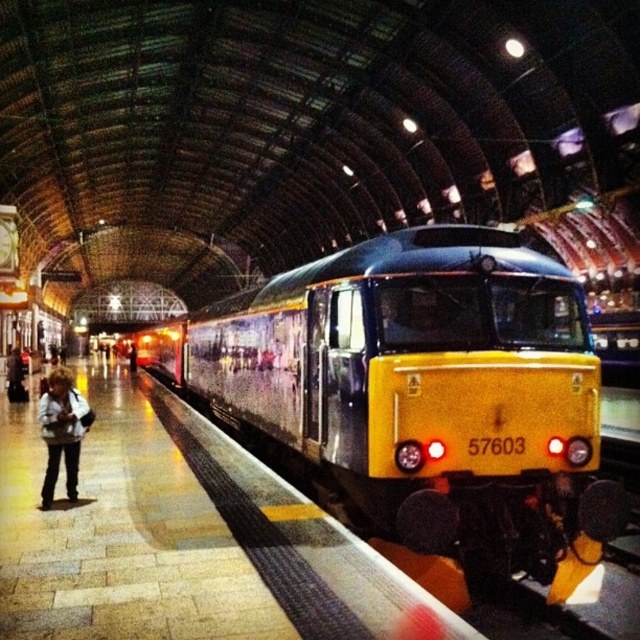
Question: Does light brown leather jacket at lower left appear on the right side of denim jacket at left?

Choices:
 (A) yes
 (B) no

Answer: (A)

Question: Which point is closer to the camera taking this photo?

Choices:
 (A) (10, 397)
 (B) (538, 275)
 (C) (76, 492)

Answer: (B)

Question: Does yellow polished metal train at center appear on the left side of light brown leather jacket at lower left?

Choices:
 (A) no
 (B) yes

Answer: (B)

Question: Based on their relative distances, which object is nearer to the denim jacket at left?

Choices:
 (A) light brown leather jacket at lower left
 (B) yellow polished metal train at center

Answer: (B)

Question: Can you confirm if yellow polished metal train at center is wider than denim jacket at left?

Choices:
 (A) no
 (B) yes

Answer: (B)

Question: Which object is closer to the camera taking this photo?

Choices:
 (A) light brown leather jacket at lower left
 (B) yellow polished metal train at center
 (C) denim jacket at left

Answer: (B)